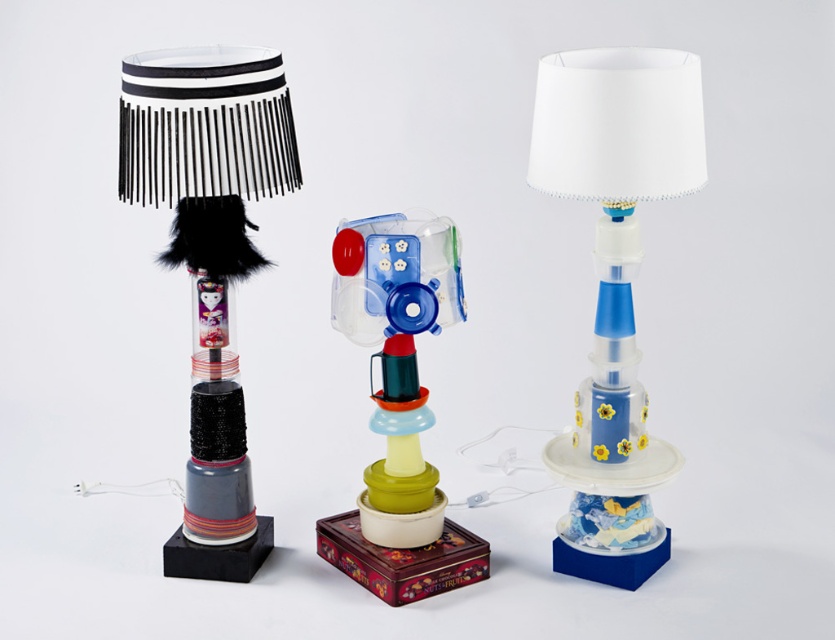
Who is more forward, (639, 74) or (458, 320)?

Point (639, 74) is more forward.

Does blue glossy lampshade at center lie behind translucent plastic toy at center?

No, it is not.

Who is more distant from viewer, (x=565, y=566) or (x=439, y=282)?

Positioned behind is point (x=565, y=566).

Locate an element on the screen. The width and height of the screenshot is (835, 640). blue glossy lampshade at center is located at coordinates (615, 284).

Is point (181, 248) positioned before point (343, 560)?

Yes, it is in front of point (343, 560).

Can you confirm if black fabric lampshade at left is positioned above translucent plastic toy at center?

Indeed, black fabric lampshade at left is positioned over translucent plastic toy at center.

Who is more forward, (223, 550) or (342, 278)?

Point (342, 278) is more forward.

At what (x,y) coordinates should I click in order to perform the action: click on black fabric lampshade at left. Please return your answer as a coordinate pair (x, y). This screenshot has height=640, width=835. Looking at the image, I should click on (210, 260).

Is blue glossy lampshade at center in front of black fabric lampshade at left?

No, it is behind black fabric lampshade at left.

Between blue glossy lampshade at center and black fabric lampshade at left, which one appears on the right side from the viewer's perspective?

blue glossy lampshade at center

This screenshot has width=835, height=640. Identify the location of blue glossy lampshade at center. (615, 284).